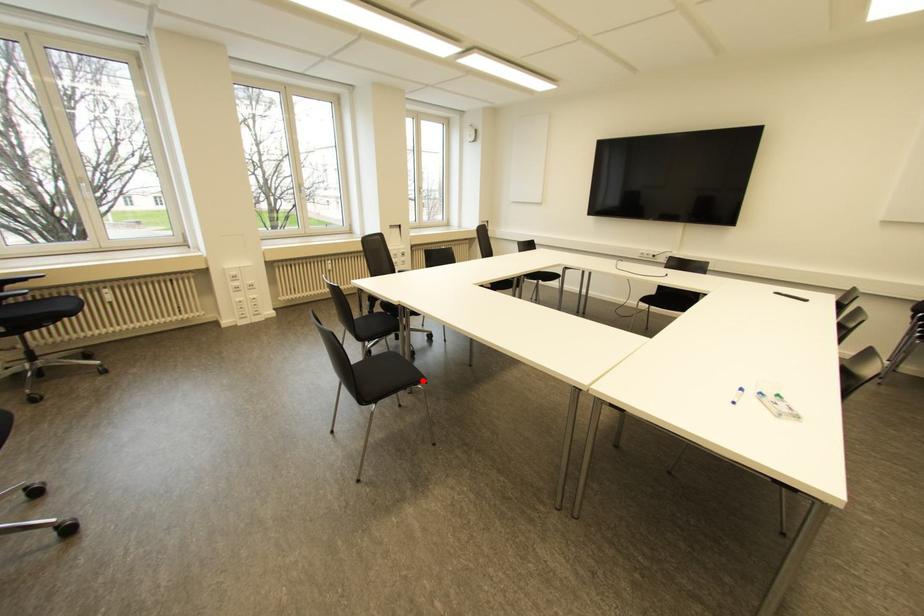
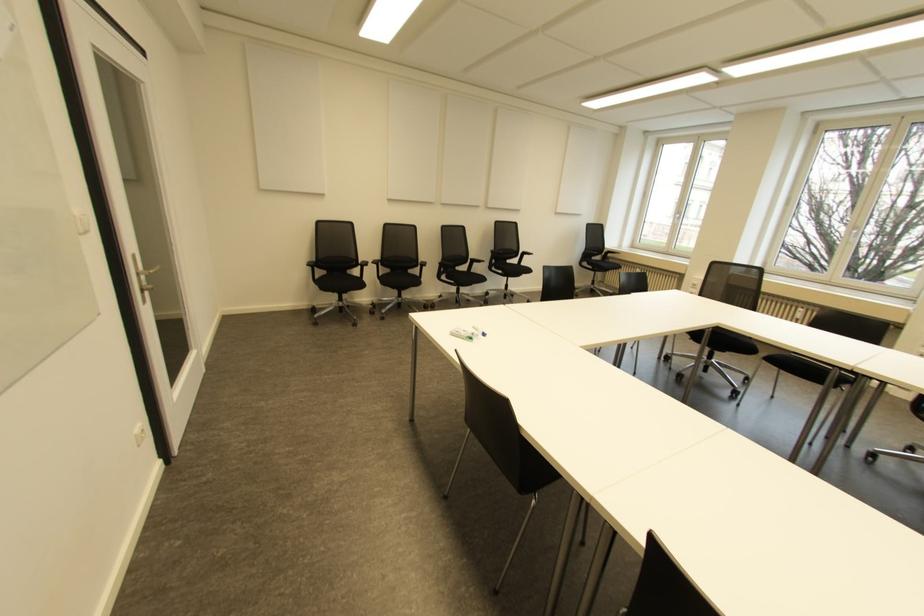
Question: I am providing you with two images of the same scene from different viewpoints. A red point is marked on the first image. Is the red point's position out of view in image 2?

Choices:
 (A) Yes
 (B) No

Answer: (A)